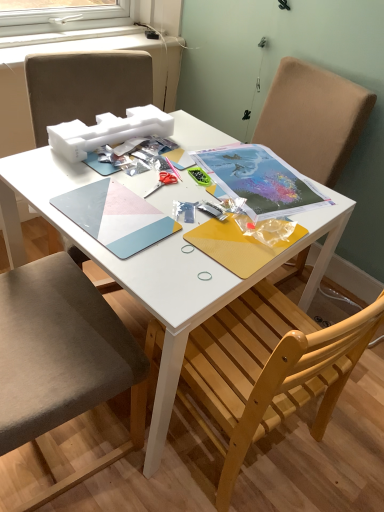
You are a GUI agent. You are given a task and a screenshot of the screen. Output one action in this format:
    pyautogui.click(x=<x>, y=<y>)
    Task: Click on the vacant location behind metallic silver scissors at center
    This screenshot has width=384, height=512.
    Given the screenshot: What is the action you would take?
    pyautogui.click(x=172, y=159)